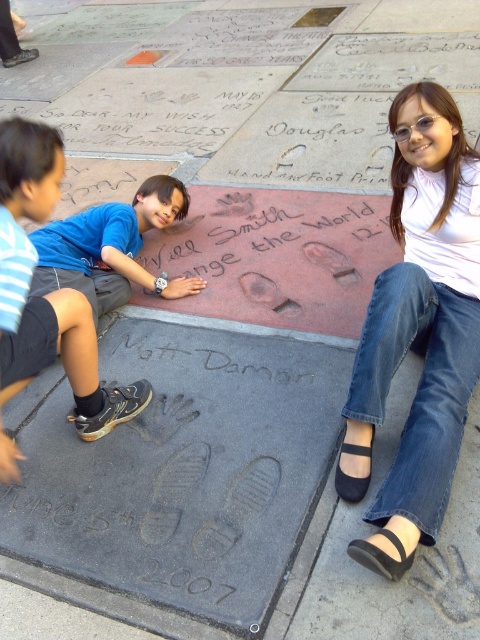
Question: Does white matte shirt at upper right have a larger size compared to black leather sandal at lower right?

Choices:
 (A) no
 (B) yes

Answer: (B)

Question: Observing the image, what is the correct spatial positioning of white matte shirt at upper right in reference to black ink writing at center?

Choices:
 (A) below
 (B) above

Answer: (B)

Question: Which object is closer to the camera taking this photo?

Choices:
 (A) black suede sandal at lower right
 (B) black matte text at center
 (C) black leather sandal at lower right

Answer: (C)

Question: Among these points, which one is farthest from the camera?

Choices:
 (A) (391, 304)
 (B) (351, 483)
 (C) (154, 346)
 (D) (407, 563)

Answer: (C)

Question: In this image, where is black matte text at center located relative to black leather sandal at lower right?

Choices:
 (A) below
 (B) above

Answer: (B)

Question: Which point appears closest to the camera in this image?

Choices:
 (A) (35, 292)
 (B) (155, 273)
 (C) (365, 451)

Answer: (C)